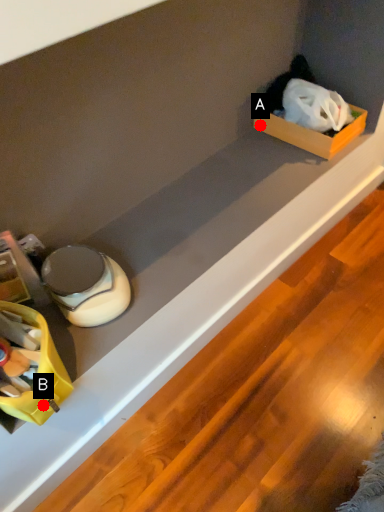
Question: Two points are circled on the image, labeled by A and B beside each circle. Among these points, which one is farthest from the camera?

Choices:
 (A) A is further
 (B) B is further

Answer: (A)